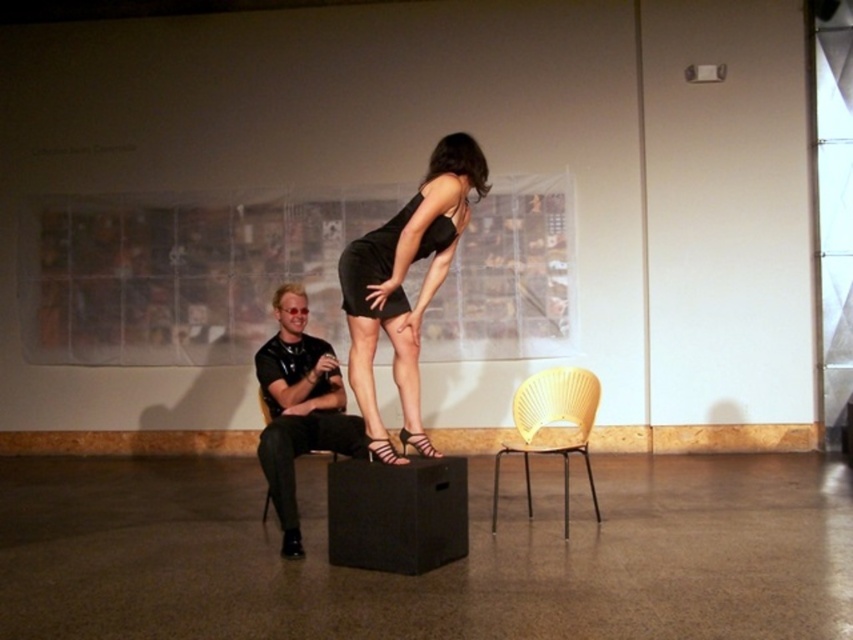
Question: Which object is farther from the camera taking this photo?

Choices:
 (A) striped leather sandal at center
 (B) shiny metallic sandal at center
 (C) black leather shoe at lower center

Answer: (C)

Question: Is black leather shirt at center smaller than black leather chair at center?

Choices:
 (A) yes
 (B) no

Answer: (B)

Question: In this image, where is yellow wood chair at center located relative to black leather shoe at lower center?

Choices:
 (A) left
 (B) right

Answer: (B)

Question: Estimate the real-world distances between objects in this image. Which object is farther from the black satin dress at center?

Choices:
 (A) black leather chair at center
 (B) yellow wood chair at center

Answer: (B)

Question: Does yellow wood chair at center have a larger size compared to black leather chair at center?

Choices:
 (A) yes
 (B) no

Answer: (A)

Question: Which of these objects is positioned closest to the black leather shoe at lower center?

Choices:
 (A) black leather shirt at center
 (B) yellow wood chair at center
 (C) black satin dress at center

Answer: (A)